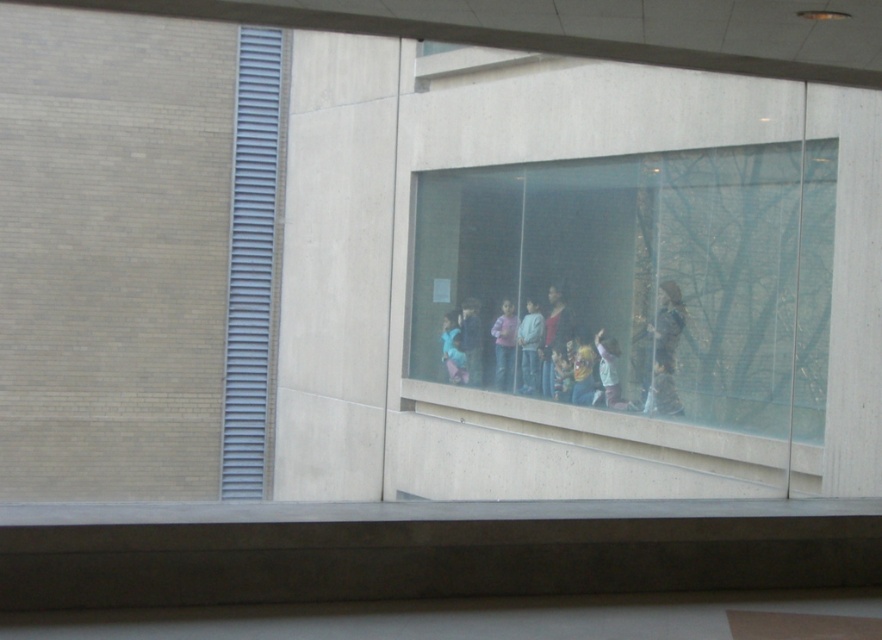
Can you confirm if transparent glass window at center is positioned below blue denim jeans at center?

No, transparent glass window at center is not below blue denim jeans at center.

Consider the image. How far apart are transparent glass window at center and blue denim jeans at center?

transparent glass window at center is 2.53 meters from blue denim jeans at center.

Locate an element on the screen. This screenshot has height=640, width=882. transparent glass window at center is located at coordinates (644, 276).

Between point (512, 380) and point (611, 378), which one is positioned behind?

The point (512, 380) is behind.

Measure the distance between striped sweater at center and camera.

striped sweater at center is 24.09 meters from camera.

Describe the element at coordinates (505, 346) in the screenshot. I see `striped sweater at center` at that location.

Locate an element on the screen. Image resolution: width=882 pixels, height=640 pixels. striped sweater at center is located at coordinates (505, 346).

Is transparent glass window at center closer to the viewer compared to light green fabric shirt at center?

That is True.

Does transparent glass window at center appear over light green fabric shirt at center?

Correct, transparent glass window at center is located above light green fabric shirt at center.

Identify the location of transparent glass window at center. This screenshot has height=640, width=882. (644, 276).